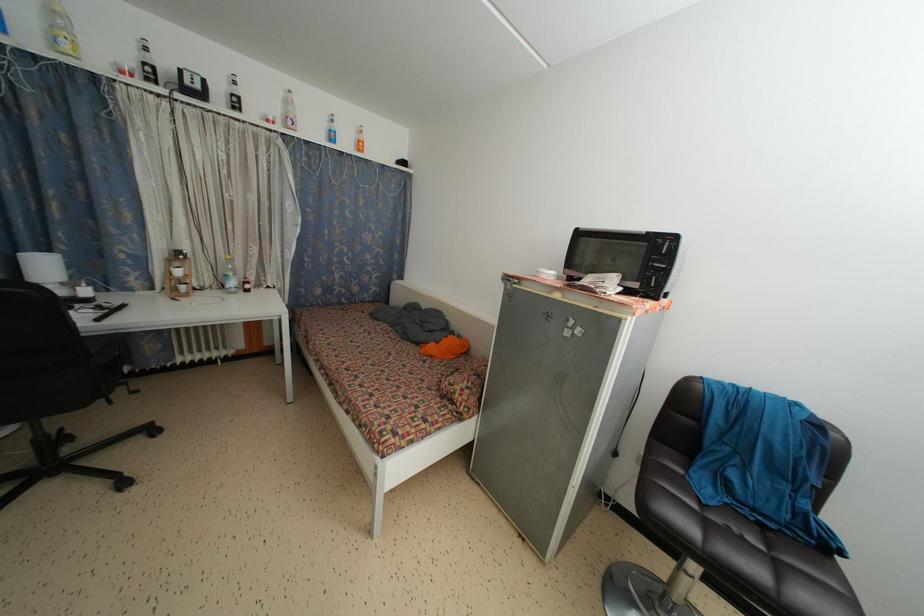
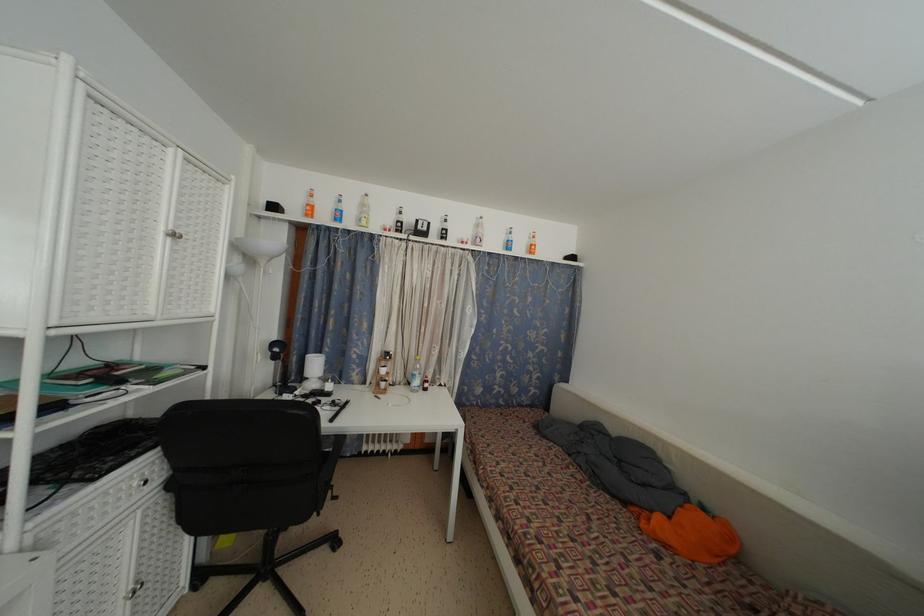
The point at (421,350) is marked in the first image. Where is the corresponding point in the second image?

(629, 509)